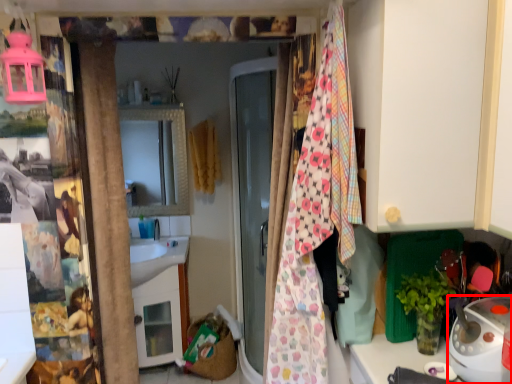
Question: From the image's perspective, what is the correct spatial positioning of appliance (annotated by the red box) in reference to blanket?

Choices:
 (A) above
 (B) below

Answer: (B)